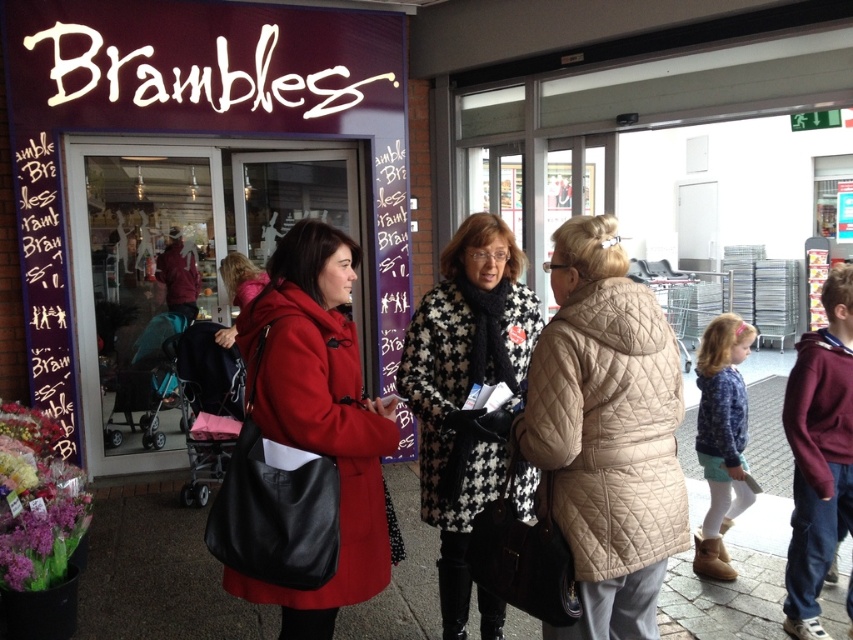
Question: Which point is farther to the camera?

Choices:
 (A) (601, 561)
 (B) (519, 374)
 (C) (793, 372)

Answer: (C)

Question: Which of the following is the farthest from the observer?

Choices:
 (A) matte black coat at center
 (B) beige quilted coat at center
 (C) maroon fleece hoodie at right

Answer: (C)

Question: Is beige quilted coat at center closer to the viewer compared to maroon fleece hoodie at right?

Choices:
 (A) no
 (B) yes

Answer: (B)

Question: Can you confirm if matte black coat at center is smaller than beige quilted coat at center?

Choices:
 (A) no
 (B) yes

Answer: (A)

Question: Is beige quilted coat at center further to camera compared to houndstooth fabric coat at center?

Choices:
 (A) no
 (B) yes

Answer: (A)

Question: Estimate the real-world distances between objects in this image. Which object is farther from the matte black coat at center?

Choices:
 (A) maroon fleece hoodie at right
 (B) beige quilted coat at center

Answer: (A)